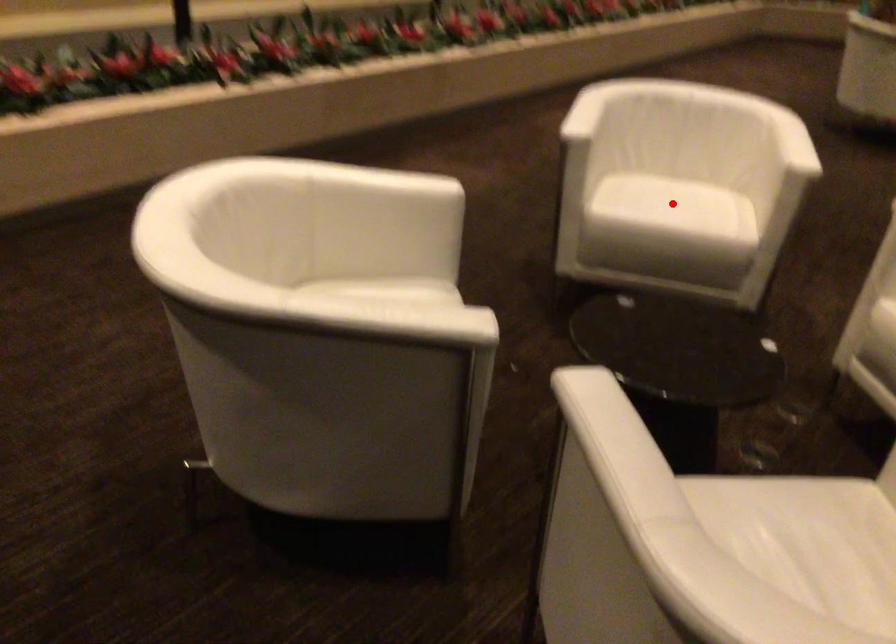
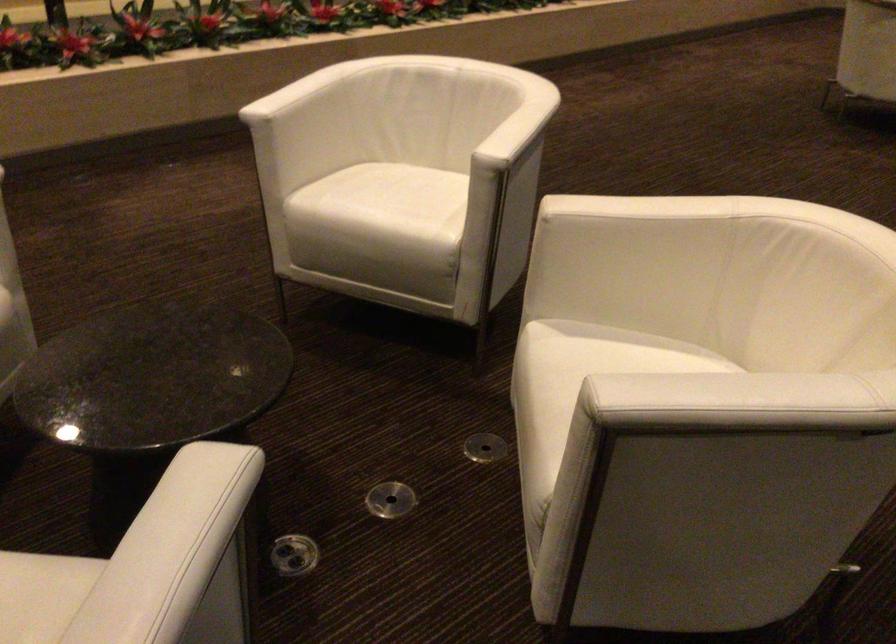
Question: I am providing you with two images of the same scene from different viewpoints. Image1 has a red point marked. In image2, the corresponding 3D location appears at what relative position? Reply with the corresponding letter.

Choices:
 (A) Closer
 (B) Farther

Answer: (A)